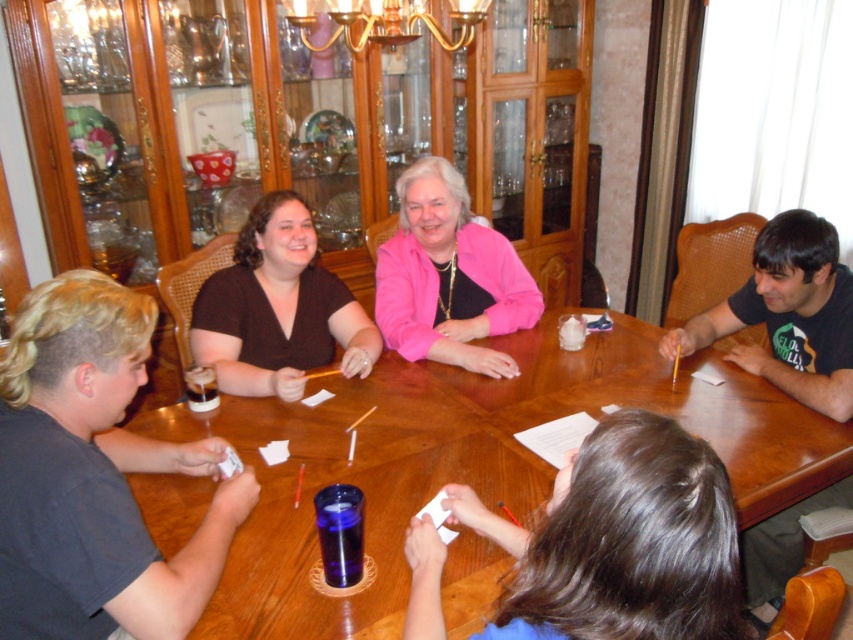
Can you confirm if dark brown fabric shirt at upper left is taller than pink matte jacket at center?

In fact, dark brown fabric shirt at upper left may be shorter than pink matte jacket at center.

Can you confirm if dark brown fabric shirt at upper left is smaller than pink matte jacket at center?

Correct, dark brown fabric shirt at upper left occupies less space than pink matte jacket at center.

Identify the location of dark brown fabric shirt at upper left. The width and height of the screenshot is (853, 640). (94, 474).

At what (x,y) coordinates should I click in order to perform the action: click on dark brown fabric shirt at upper left. Please return your answer as a coordinate pair (x, y). The width and height of the screenshot is (853, 640). Looking at the image, I should click on (94, 474).

Between wooden table at center and dark brown fabric shirt at upper left, which one is positioned lower?

wooden table at center

The width and height of the screenshot is (853, 640). Describe the element at coordinates (469, 460) in the screenshot. I see `wooden table at center` at that location.

The image size is (853, 640). Find the location of `wooden table at center`. wooden table at center is located at coordinates (469, 460).

Which is more to the right, brown hair at lower center or pink matte jacket at center?

Positioned to the right is brown hair at lower center.

Measure the distance between brown hair at lower center and camera.

The distance of brown hair at lower center from camera is 28.45 inches.

Image resolution: width=853 pixels, height=640 pixels. I want to click on brown hair at lower center, so click(622, 541).